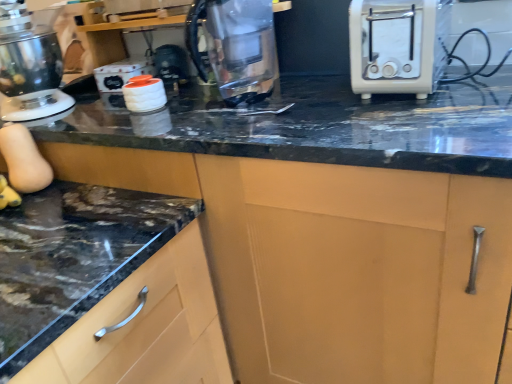
Question: Is metallic silver stand mixer at left taller than transparent glass kettle at center?

Choices:
 (A) no
 (B) yes

Answer: (B)

Question: Considering the relative sizes of metallic silver stand mixer at left and transparent glass kettle at center in the image provided, is metallic silver stand mixer at left wider than transparent glass kettle at center?

Choices:
 (A) yes
 (B) no

Answer: (A)

Question: Does metallic silver stand mixer at left appear on the right side of transparent glass kettle at center?

Choices:
 (A) yes
 (B) no

Answer: (B)

Question: From a real-world perspective, is metallic silver stand mixer at left positioned over transparent glass kettle at center based on gravity?

Choices:
 (A) yes
 (B) no

Answer: (A)

Question: From the image's perspective, is metallic silver stand mixer at left located beneath transparent glass kettle at center?

Choices:
 (A) no
 (B) yes

Answer: (A)

Question: Is metallic silver stand mixer at left oriented away from transparent glass kettle at center?

Choices:
 (A) no
 (B) yes

Answer: (A)

Question: Can you confirm if white glossy canisters at upper center is bigger than matte wood cabinet at lower left?

Choices:
 (A) no
 (B) yes

Answer: (A)

Question: Can you confirm if white glossy canisters at upper center is thinner than matte wood cabinet at lower left?

Choices:
 (A) yes
 (B) no

Answer: (A)

Question: From the image's perspective, is white glossy canisters at upper center over matte wood cabinet at lower left?

Choices:
 (A) no
 (B) yes

Answer: (B)

Question: Can we say white glossy canisters at upper center lies outside matte wood cabinet at lower left?

Choices:
 (A) no
 (B) yes

Answer: (B)

Question: Could you tell me if white glossy canisters at upper center is facing matte wood cabinet at lower left?

Choices:
 (A) no
 (B) yes

Answer: (A)

Question: From a real-world perspective, is white glossy canisters at upper center on matte wood cabinet at lower left?

Choices:
 (A) no
 (B) yes

Answer: (B)

Question: Does transparent glass kettle at center appear on the left side of white glossy canisters at upper center?

Choices:
 (A) no
 (B) yes

Answer: (A)